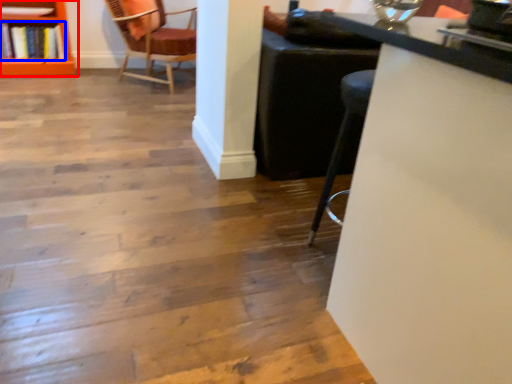
Question: Which point is closer to the camera, shelf (highlighted by a red box) or book (highlighted by a blue box)?

Choices:
 (A) shelf
 (B) book

Answer: (A)